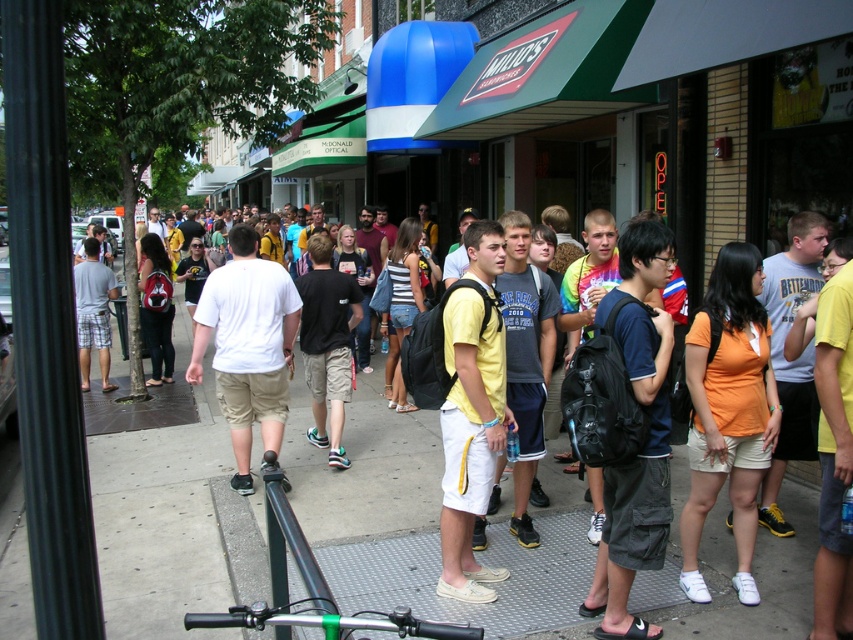
Question: Based on their relative distances, which object is nearer to the yellow cotton shirt at center?

Choices:
 (A) yellow t-shirt at center
 (B) black cotton shirt at center

Answer: (A)

Question: Which point is farther to the camera?

Choices:
 (A) yellow cotton shirt at center
 (B) white cotton t-shirt at center
 (C) orange cotton shirt at center-right

Answer: (B)

Question: Does yellow t-shirt at center appear under orange cotton shirt at center-right?

Choices:
 (A) no
 (B) yes

Answer: (B)

Question: Can you confirm if orange cotton shirt at center-right is positioned to the left of white cotton t-shirt at center?

Choices:
 (A) no
 (B) yes

Answer: (A)

Question: In this image, where is yellow cotton shirt at center located relative to light gray plaid shorts at center?

Choices:
 (A) left
 (B) right

Answer: (B)

Question: Which of the following is the closest to the observer?

Choices:
 (A) yellow t-shirt at center
 (B) yellow cotton shirt at center
 (C) white cotton t-shirt at center
 (D) orange cotton shirt at center-right

Answer: (D)